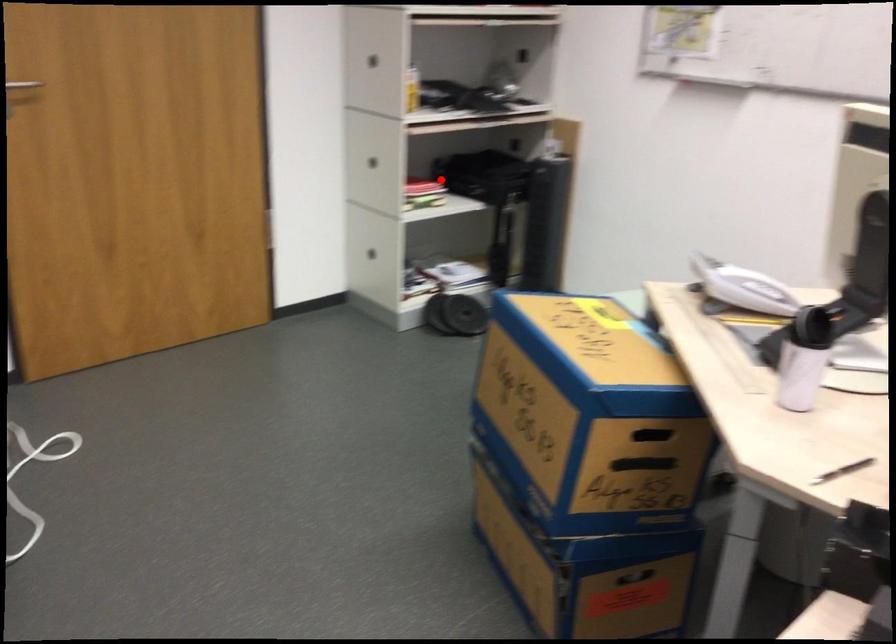
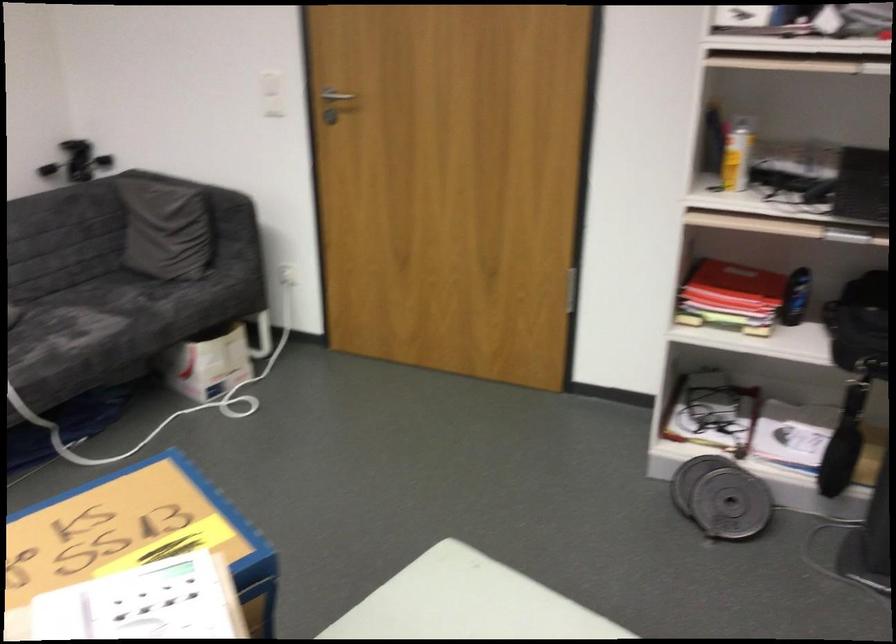
Question: I am providing you with two images of the same scene from different viewpoints. A red point is shown in image1. For the corresponding object point in image2, is it positioned nearer or farther from the camera?

Choices:
 (A) Nearer
 (B) Farther

Answer: (A)